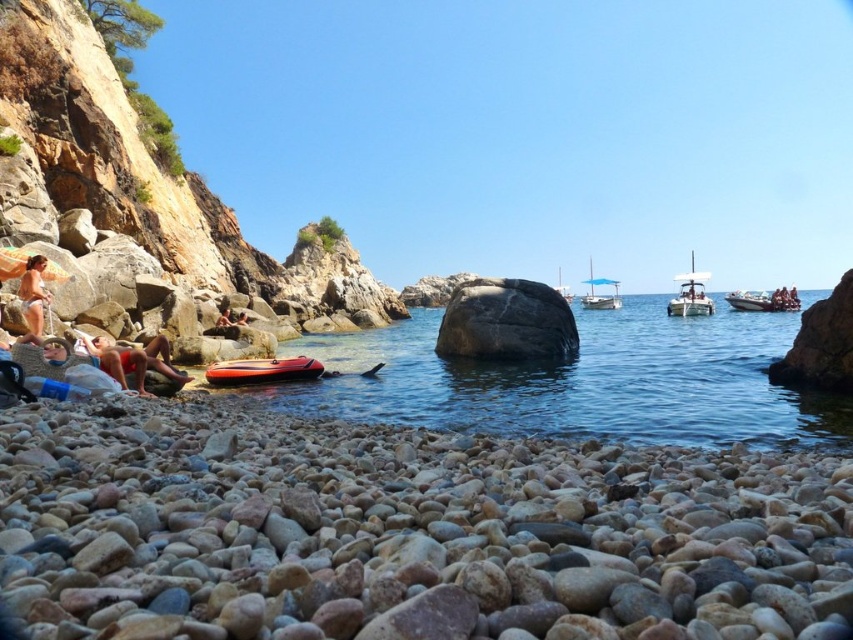
You are standing at the point with coordinates point (712,314) and want to walk to the point with coordinates point (440,387). Which direction should you move in to reach your destination?

You should move forward because point (440,387) is in front of point (712,314).

You are a photographer setting up a camera on the pebble beach. You need to position yourself so that both the red fabric shorts at lower left and the matte white bikini at left are visible in the frame. Which object should you place closer to the edge of the frame to ensure both are fully visible?

Since the red fabric shorts at lower left has a lesser width compared to the matte white bikini at left, you should place the wider matte white bikini at left closer to the edge of the frame to ensure both objects fit within the camera frame.

You are standing at the center of the image. Which direction should you look to see the white glossy boat at right?

The white glossy boat at right is located at the right side of the image, so you should look to your right to see it.